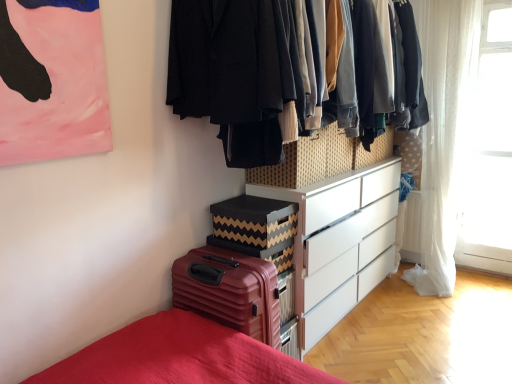
Question: Is matte brown suitcase at lower left in front of or behind white matte chest of drawers at center in the image?

Choices:
 (A) front
 (B) behind

Answer: (A)

Question: Considering the positions of matte brown suitcase at lower left and white matte chest of drawers at center in the image, is matte brown suitcase at lower left taller or shorter than white matte chest of drawers at center?

Choices:
 (A) short
 (B) tall

Answer: (A)

Question: Estimate the real-world distances between objects in this image. Which object is farther from the white sheer curtain at right?

Choices:
 (A) woven fabric drawer at center
 (B) textured fabric clothes at upper center
 (C) white matte chest of drawers at center
 (D) matte brown suitcase at lower left
 (E) white sheer curtain at right

Answer: (D)

Question: Which is farther from the white sheer curtain at right?

Choices:
 (A) woven fabric drawer at center
 (B) textured fabric clothes at upper center
 (C) white sheer curtain at right
 (D) white matte chest of drawers at center
 (E) matte brown suitcase at lower left

Answer: (E)